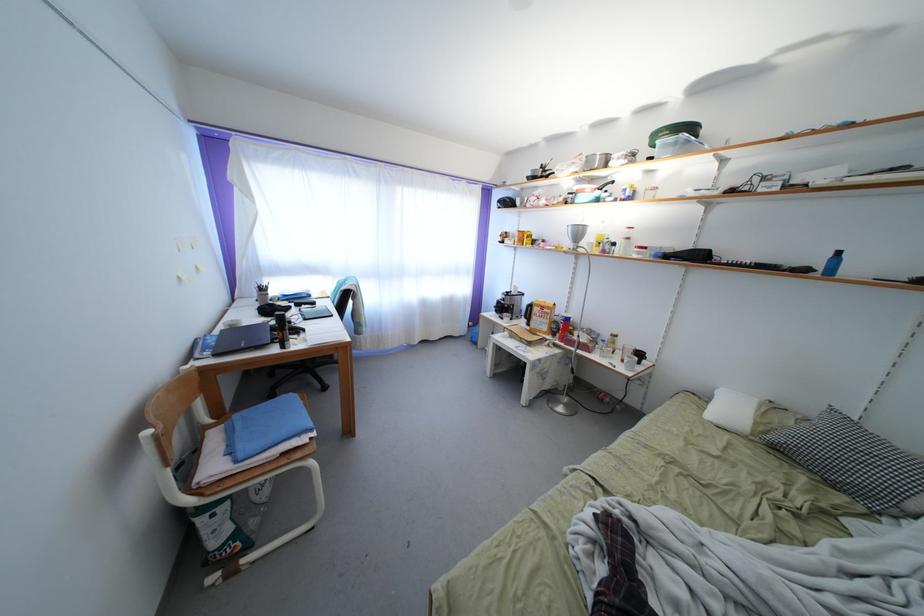
Which object does [675,131] point to?

This point indicates the green lidded container.